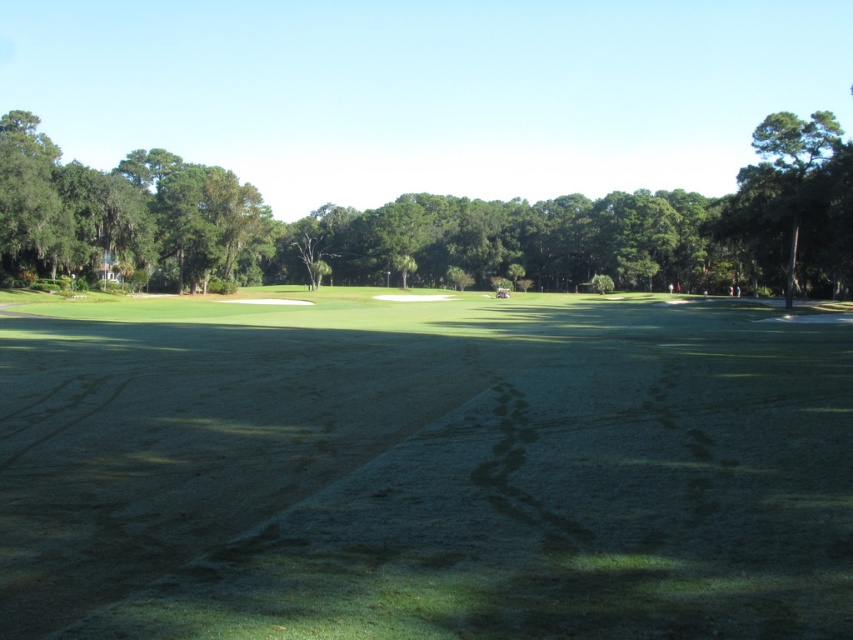
You are a golfer standing on the fairway looking towards the putting green. You notice the green grass at center and the green leafy tree at upper right. Which object is positioned higher in the image?

The green leafy tree at upper right is positioned higher in the image than the green grass at center.

You are standing on the golf course and see two points marked on the fairway. The first point is at coordinates point (138,550) and the second is at point (747,184). Which point is closer to you?

Point (138,550) is closer to the viewer than point (747,184).

You are standing at the center of the golf course and see two trees. The first is the green leafy tree at center and the second is the green leafy tree at upper right. Which tree is positioned more to the right side?

The green leafy tree at upper right is positioned more to the right side than the green leafy tree at center.